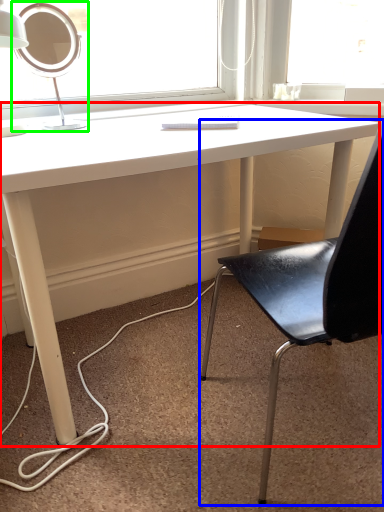
Question: Considering the real-world distances, which object is closest to desk (highlighted by a red box)? chair (highlighted by a blue box) or table lamp (highlighted by a green box).

Choices:
 (A) chair
 (B) table lamp

Answer: (B)